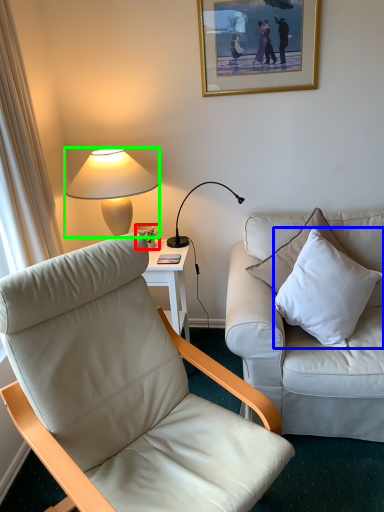
Question: Considering the real-world distances, which object is farthest from coffee cup (highlighted by a red box)? pillow (highlighted by a blue box) or lamp (highlighted by a green box)?

Choices:
 (A) pillow
 (B) lamp

Answer: (A)